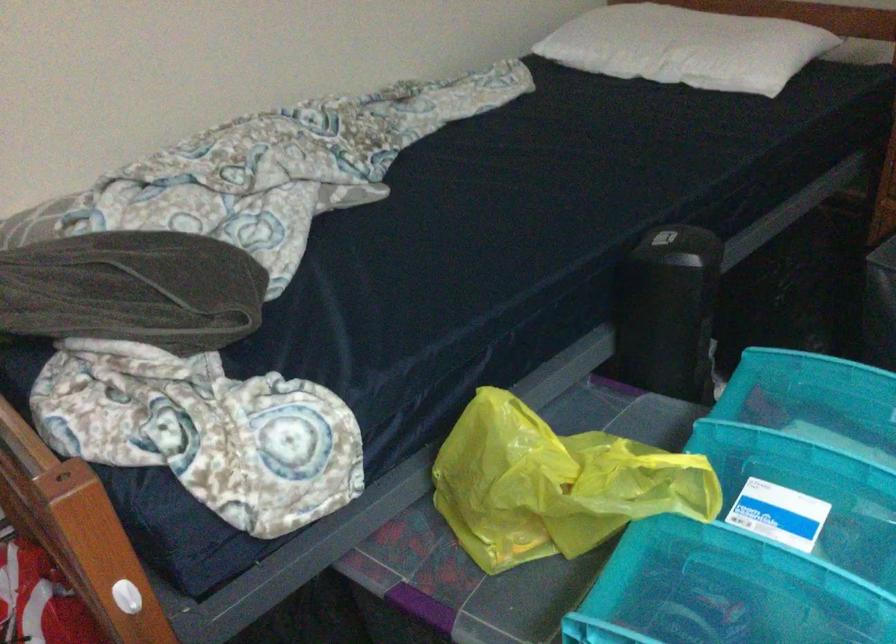
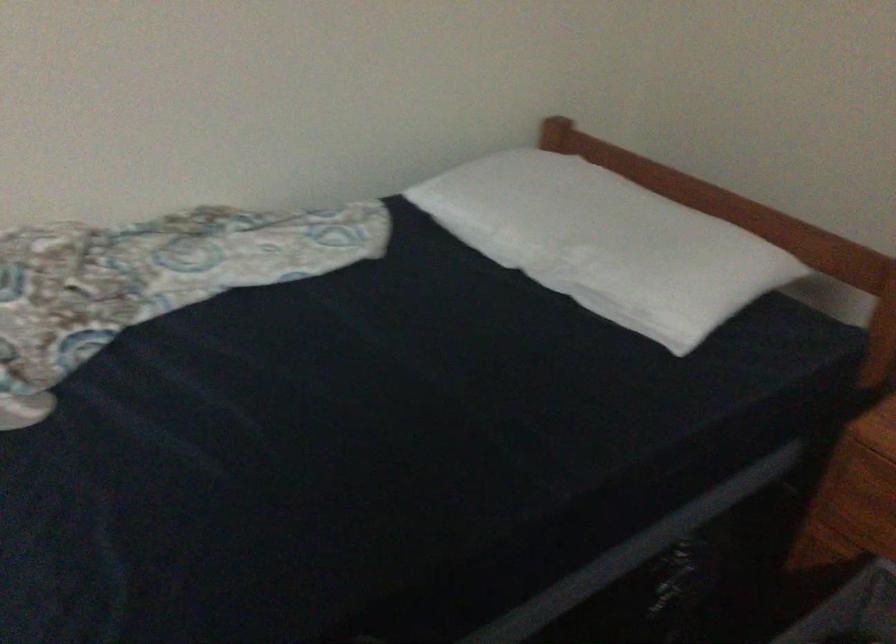
Question: How did the camera likely rotate?

Choices:
 (A) Left
 (B) Right
 (C) Up
 (D) Down

Answer: (C)